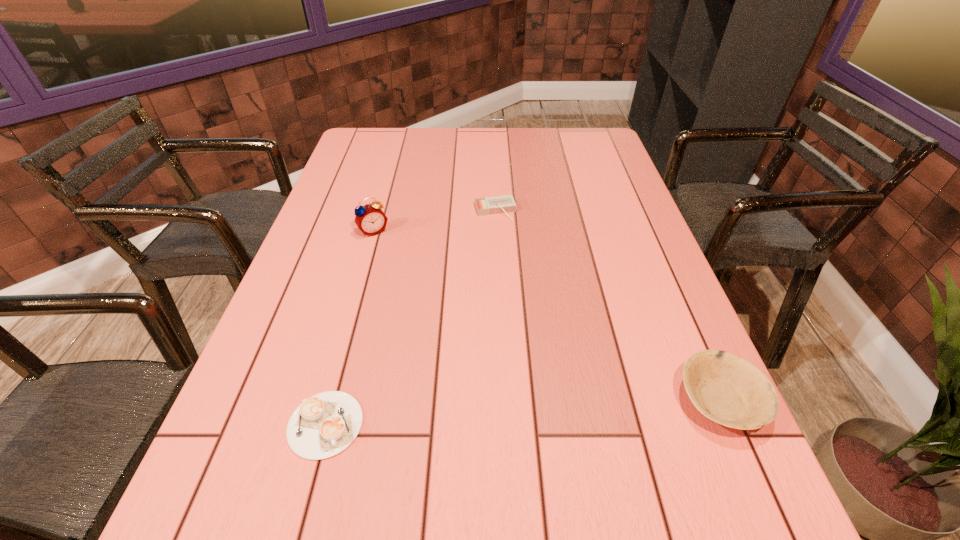
At what (x,y) coordinates should I click in order to perform the action: click on vacant area between the cappuccino and the second farthest object. Please return your answer as a coordinate pair (x, y). Looking at the image, I should click on (349, 328).

Image resolution: width=960 pixels, height=540 pixels. In order to click on vacant space that is in between the bowl and the cappuccino in this screenshot , I will do `click(522, 413)`.

The height and width of the screenshot is (540, 960). I want to click on free spot between the third nearest object and the farthest object, so click(x=435, y=221).

Find the location of `free space between the shortest object and the third nearest object`. free space between the shortest object and the third nearest object is located at coordinates (349, 328).

I want to click on free space between the matchbox and the shortest object, so pyautogui.click(x=410, y=318).

At what (x,y) coordinates should I click in order to perform the action: click on free space between the alarm clock and the second shortest object. Please return your answer as a coordinate pair (x, y). The height and width of the screenshot is (540, 960). Looking at the image, I should click on (435, 221).

The image size is (960, 540). I want to click on free space between the bowl and the shortest object, so coord(522,413).

Select which object is the second closest to the cappuccino. Please provide its 2D coordinates. Your answer should be formatted as a tuple, i.e. [(x, y)], where the tuple contains the x and y coordinates of a point satisfying the conditions above.

[(499, 204)]

Choose which object is the third nearest neighbor to the shortest object. Please provide its 2D coordinates. Your answer should be formatted as a tuple, i.e. [(x, y)], where the tuple contains the x and y coordinates of a point satisfying the conditions above.

[(726, 388)]

Find the location of a particular element. The width and height of the screenshot is (960, 540). vacant space that satisfies the following two spatial constraints: 1. on the back side of the cappuccino; 2. on the left side of the matchbox is located at coordinates (383, 211).